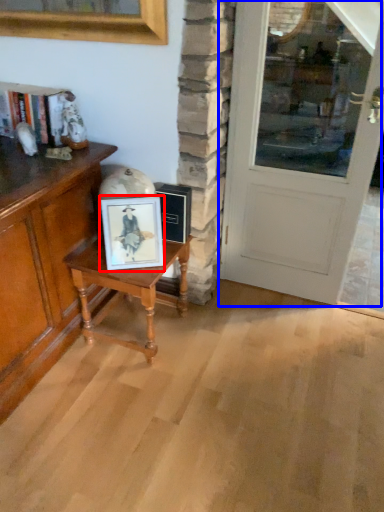
Question: Among these objects, which one is farthest to the camera, picture frame (highlighted by a red box) or door (highlighted by a blue box)?

Choices:
 (A) picture frame
 (B) door

Answer: (A)